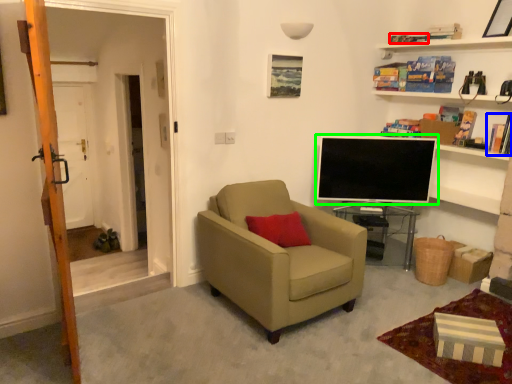
Question: Considering the real-world distances, which object is closest to book (highlighted by a red box)? book (highlighted by a blue box) or television (highlighted by a green box).

Choices:
 (A) book
 (B) television

Answer: (A)